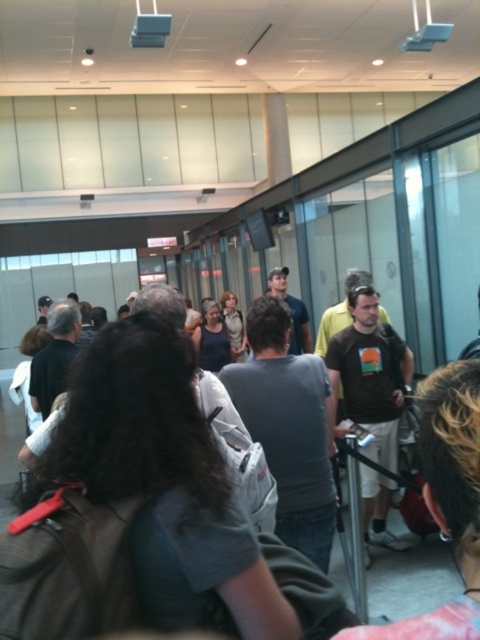
Question: Is dark gray t-shirt at center behind black cotton t-shirt at center?

Choices:
 (A) yes
 (B) no

Answer: (A)

Question: Does dark gray fabric backpack at center lie behind matte black shirt at center?

Choices:
 (A) no
 (B) yes

Answer: (A)

Question: Which point is closer to the camera taking this photo?

Choices:
 (A) coord(456,557)
 (B) coord(157,477)

Answer: (A)

Question: Does matte black shirt at center appear over light brown leather jacket at center?

Choices:
 (A) yes
 (B) no

Answer: (B)

Question: Which point is farther to the camera?

Choices:
 (A) black cotton t-shirt at center
 (B) matte black shirt at center
 (C) light brown leather jacket at center
 (D) dark gray t-shirt at center

Answer: (C)

Question: Which point is farther to the camera?

Choices:
 (A) matte black shirt at center
 (B) dark gray fabric backpack at center
 (C) light brown leather jacket at center
 (D) dark gray t-shirt at center

Answer: (C)